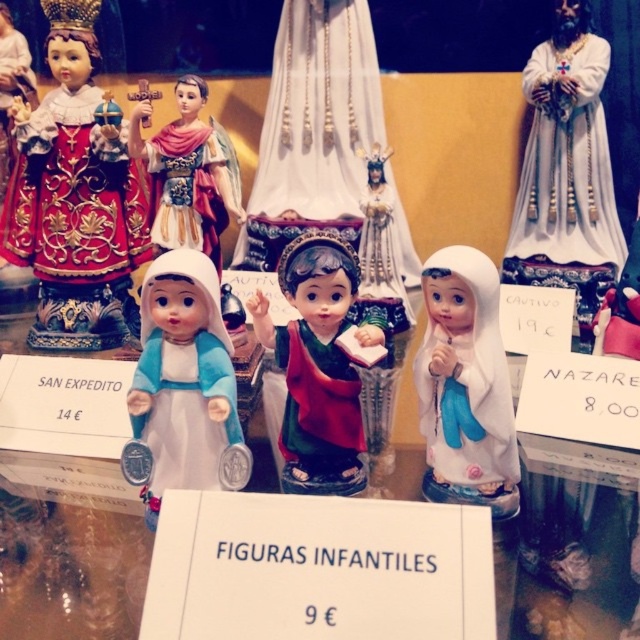
Question: Does white glossy figurine at center appear on the right side of matte porcelain doll at center?

Choices:
 (A) no
 (B) yes

Answer: (B)

Question: Considering the relative positions of matte red fabric doll at center and white glossy doll at center in the image provided, where is matte red fabric doll at center located with respect to white glossy doll at center?

Choices:
 (A) below
 (B) above

Answer: (B)

Question: Based on their relative distances, which object is nearer to the matte red fabric doll at center?

Choices:
 (A) matte porcelain doll at center
 (B) matte gold statue at upper left
 (C) white glossy figurine at center
 (D) white glossy doll at center

Answer: (C)

Question: Can you confirm if matte gold statue at upper left is smaller than matte red fabric doll at center?

Choices:
 (A) no
 (B) yes

Answer: (A)

Question: Considering the real-world distances, which object is farthest from the white glossy figurine at center?

Choices:
 (A) matte gold statue at upper left
 (B) white glossy doll at center

Answer: (A)

Question: Which of the following is the closest to the observer?

Choices:
 (A) (540, 49)
 (B) (220, 388)
 (C) (132, 170)

Answer: (B)